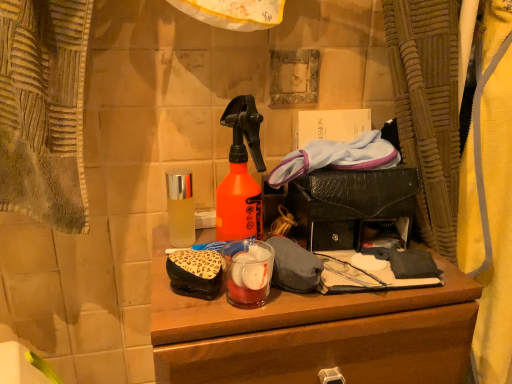
Question: From the image's perspective, is clear glass bottle at center located beneath wooden desk at center?

Choices:
 (A) yes
 (B) no

Answer: (B)

Question: Is clear glass bottle at center positioned behind wooden desk at center?

Choices:
 (A) no
 (B) yes

Answer: (B)

Question: Does clear glass bottle at center appear on the right side of wooden desk at center?

Choices:
 (A) yes
 (B) no

Answer: (B)

Question: Is clear glass bottle at center not inside wooden desk at center?

Choices:
 (A) no
 (B) yes

Answer: (B)

Question: Is clear glass bottle at center not near wooden desk at center?

Choices:
 (A) no
 (B) yes

Answer: (A)

Question: Is point (176, 276) closer or farther from the camera than point (295, 321)?

Choices:
 (A) closer
 (B) farther

Answer: (B)

Question: Is leopard print fabric pouch at center inside or outside of wooden desk at center?

Choices:
 (A) outside
 (B) inside

Answer: (A)

Question: Considering the relative positions of leopard print fabric pouch at center and wooden desk at center in the image provided, is leopard print fabric pouch at center to the left or to the right of wooden desk at center?

Choices:
 (A) left
 (B) right

Answer: (A)

Question: Looking at their shapes, would you say leopard print fabric pouch at center is wider or thinner than wooden desk at center?

Choices:
 (A) wide
 (B) thin

Answer: (B)

Question: Considering the positions of point (174, 233) and point (412, 337), is point (174, 233) closer or farther from the camera than point (412, 337)?

Choices:
 (A) closer
 (B) farther

Answer: (B)

Question: Is clear glass bottle at center to the left or to the right of wooden desk at center in the image?

Choices:
 (A) right
 (B) left

Answer: (B)

Question: From a real-world perspective, is clear glass bottle at center positioned above or below wooden desk at center?

Choices:
 (A) below
 (B) above

Answer: (B)

Question: Choose the correct answer: Is clear glass bottle at center inside wooden desk at center or outside it?

Choices:
 (A) outside
 (B) inside

Answer: (A)

Question: From the image's perspective, is wooden desk at center positioned above or below clear glass bottle at center?

Choices:
 (A) below
 (B) above

Answer: (A)

Question: Would you say wooden desk at center is inside or outside clear glass bottle at center?

Choices:
 (A) inside
 (B) outside

Answer: (B)